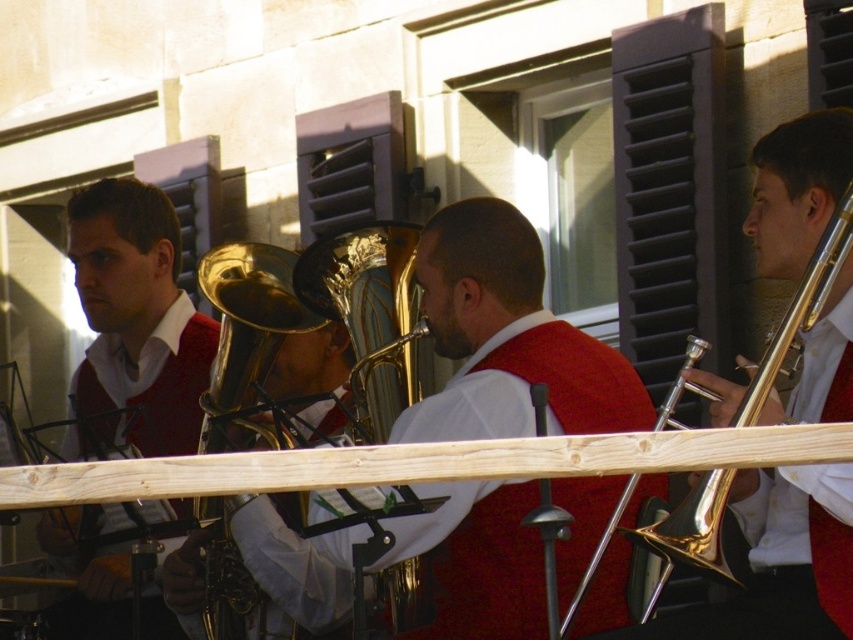
Question: Which of the following is the farthest from the observer?

Choices:
 (A) gold shiny trumpet at right
 (B) matte red sweater at left
 (C) shiny gold tuba at center
 (D) gold shiny trumpet at center

Answer: (D)

Question: Does shiny gold tuba at center appear under gold shiny trumpet at right?

Choices:
 (A) no
 (B) yes

Answer: (B)

Question: Which point is farther from the camera taking this photo?

Choices:
 (A) (140, 259)
 (B) (402, 362)
 (C) (833, 227)

Answer: (A)

Question: Is shiny gold tuba at center positioned in front of gold shiny trumpet at center?

Choices:
 (A) no
 (B) yes

Answer: (B)

Question: Which object is closer to the camera taking this photo?

Choices:
 (A) gold shiny trumpet at center
 (B) matte red sweater at left
 (C) shiny gold tuba at center

Answer: (C)

Question: Can you confirm if shiny gold tuba at center is thinner than gold shiny trumpet at center?

Choices:
 (A) no
 (B) yes

Answer: (B)